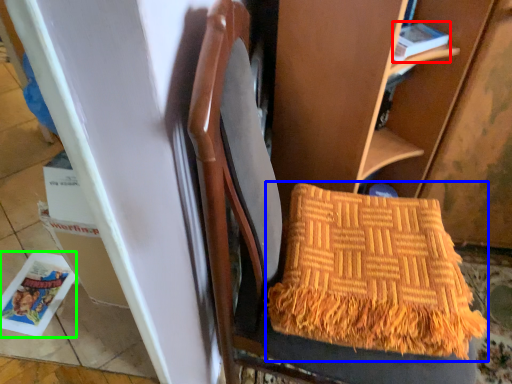
Question: Considering the real-world distances, which object is closest to magazine (highlighted by a red box)? blanket (highlighted by a blue box) or magazine (highlighted by a green box).

Choices:
 (A) blanket
 (B) magazine

Answer: (A)